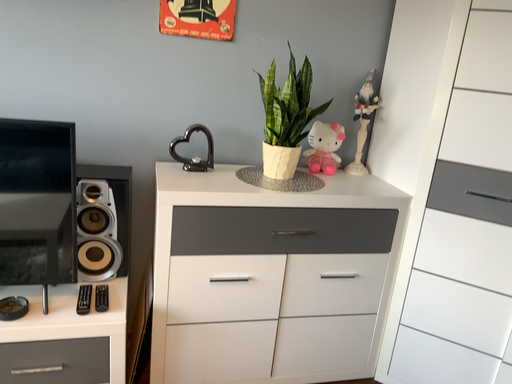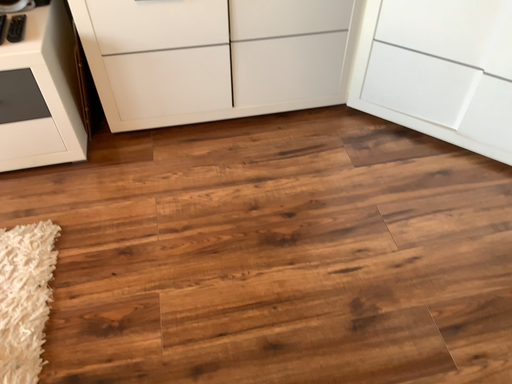
Question: Which way did the camera rotate in the video?

Choices:
 (A) rotated downward
 (B) rotated upward

Answer: (A)